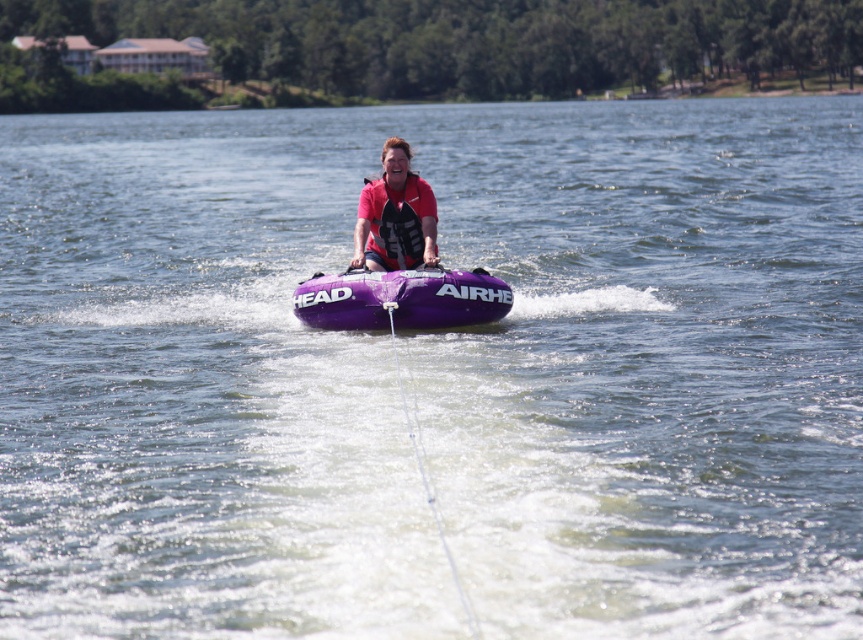
Question: Does purple inflatable tube at center lie behind matte red life vest at center?

Choices:
 (A) yes
 (B) no

Answer: (B)

Question: Is purple inflatable tube at center closer to the viewer compared to matte red life vest at center?

Choices:
 (A) yes
 (B) no

Answer: (A)

Question: Can you confirm if purple inflatable tube at center is smaller than matte red life vest at center?

Choices:
 (A) yes
 (B) no

Answer: (B)